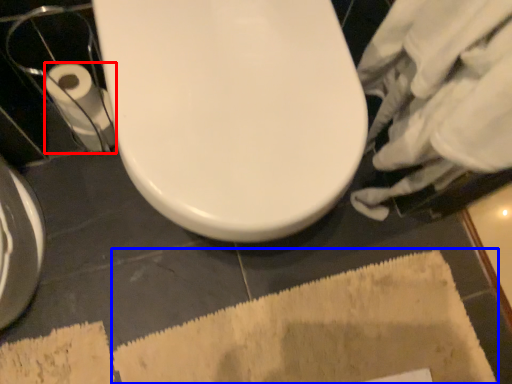
Question: Which object appears closest to the camera in this image, toilet paper (highlighted by a red box) or bath mat (highlighted by a blue box)?

Choices:
 (A) toilet paper
 (B) bath mat

Answer: (B)